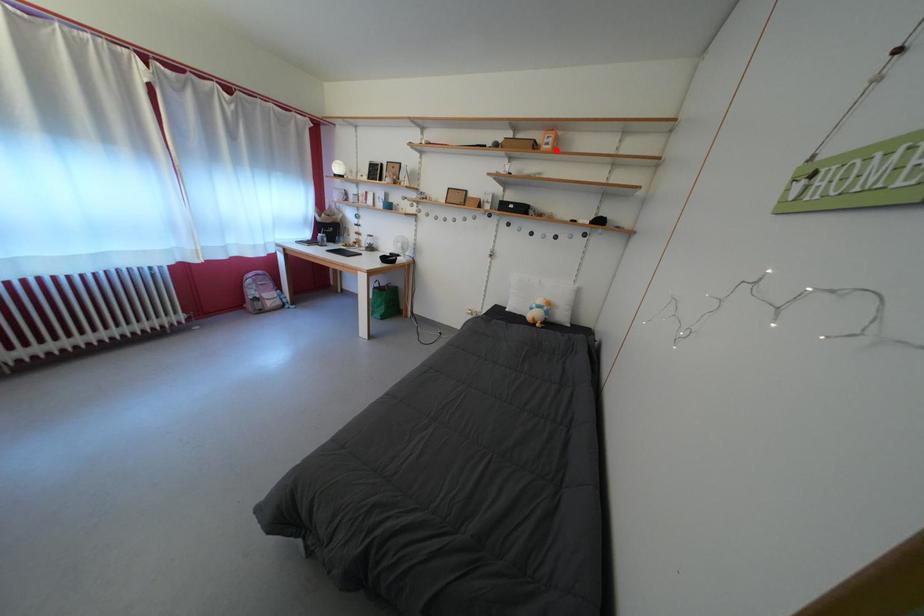
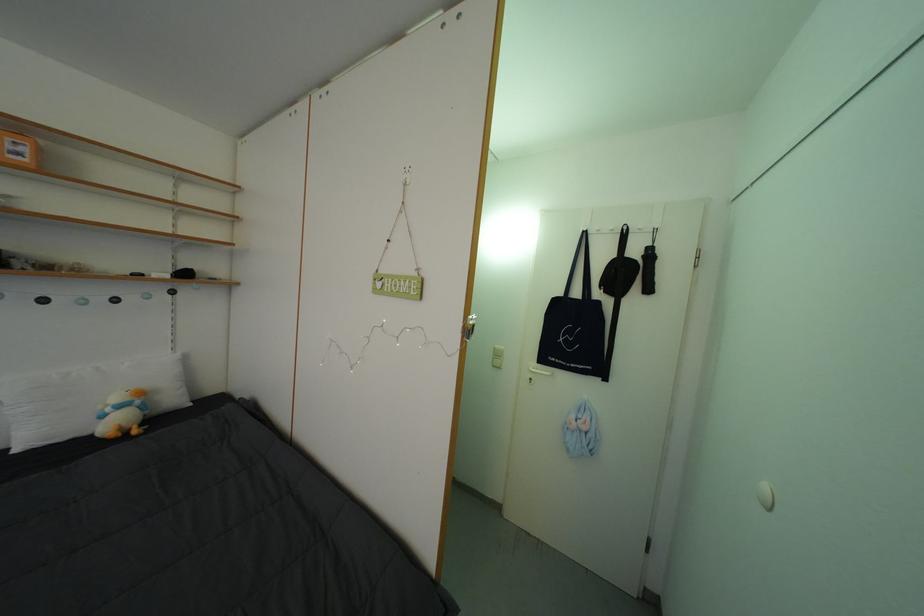
Question: I am providing you with two images of the same scene from different viewpoints. In image1, a red point is highlighted. Considering the same 3D point in image2, which of the following is correct?

Choices:
 (A) It is closer
 (B) It is farther

Answer: (B)